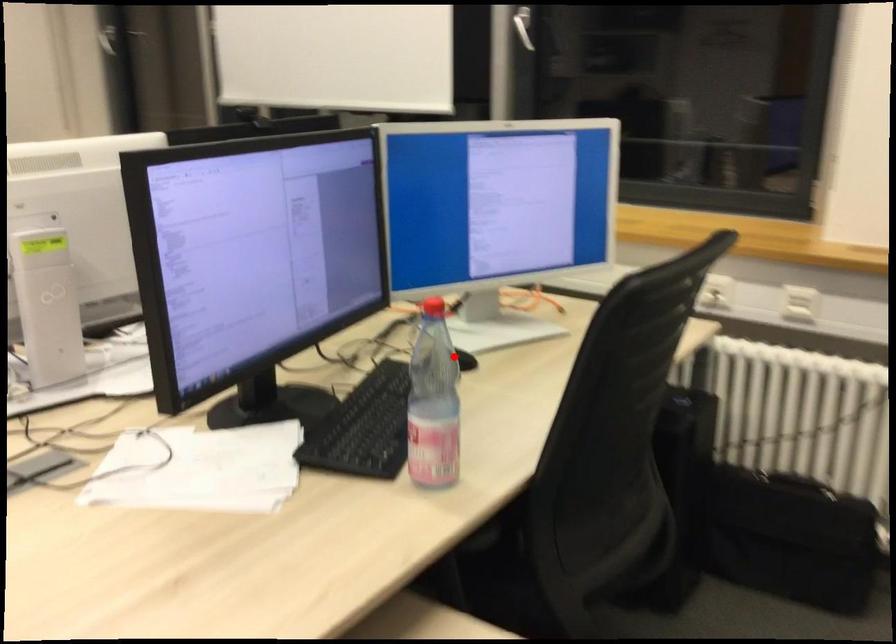
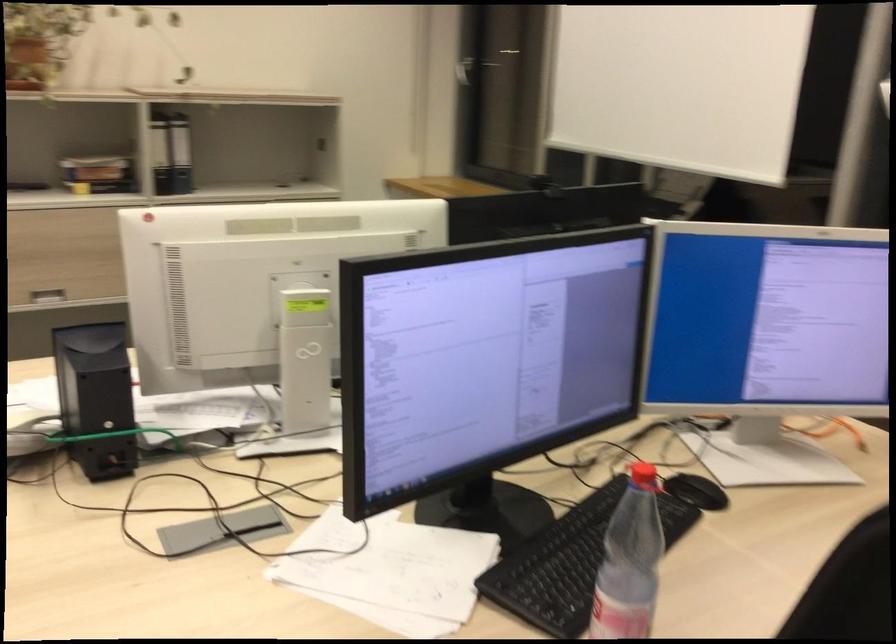
The point at the highlighted location is marked in the first image. Where is the corresponding point in the second image?

(695, 491)